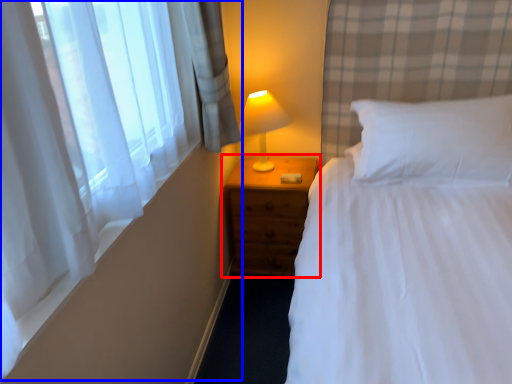
Question: Which point is further to the camera, nightstand (highlighted by a red box) or curtain (highlighted by a blue box)?

Choices:
 (A) nightstand
 (B) curtain

Answer: (A)